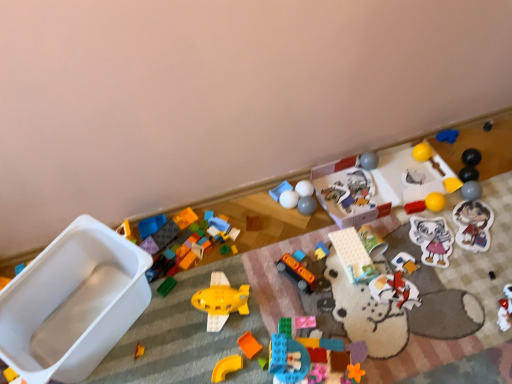
Find the location of a particular element. The height and width of the screenshot is (384, 512). vacant space in between matte plastic stickers at lower right, the 23th toy viewed from the left, and pink matte block at center, the twelfth toy viewed from the left is located at coordinates (398, 272).